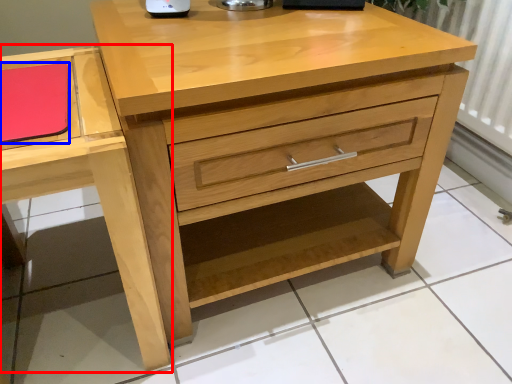
Question: Which of the following is the closest to the observer, vanity (highlighted by a red box) or notepad (highlighted by a blue box)?

Choices:
 (A) vanity
 (B) notepad

Answer: (A)